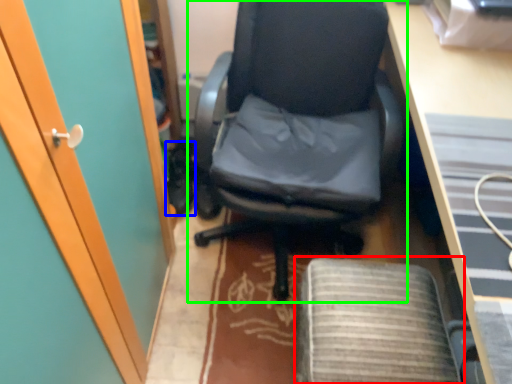
Question: Considering the real-world distances, which object is farthest from computer chair (highlighted by a red box)? footwear (highlighted by a blue box) or chair (highlighted by a green box)?

Choices:
 (A) footwear
 (B) chair

Answer: (A)